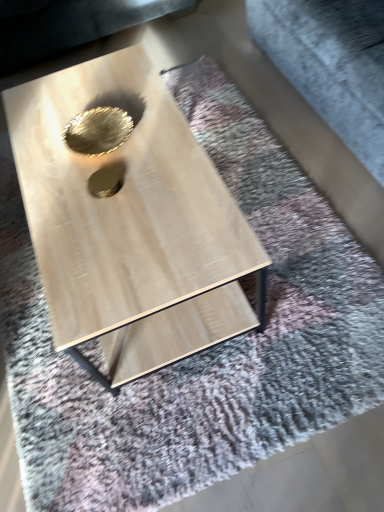
The image size is (384, 512). Identify the location of free point in front of gold metallic hole at center, the 2th hole in the back-to-front sequence. (112, 231).